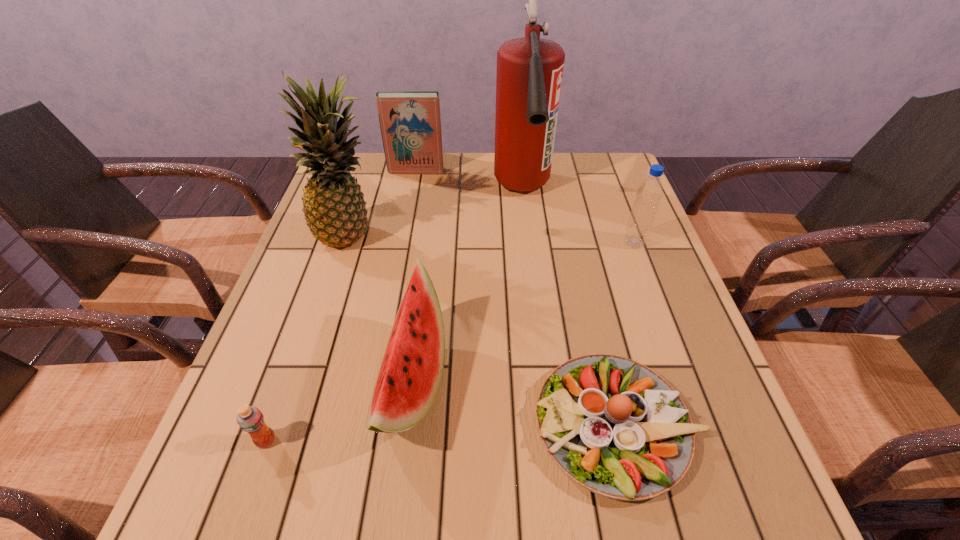
Find the location of a particular element. The width and height of the screenshot is (960, 540). salad plate present at the right edge is located at coordinates (614, 426).

Find the location of `object located at the near right corner`. object located at the near right corner is located at coordinates (614, 426).

I want to click on free space at the far edge of the desktop, so click(569, 171).

Locate an element on the screen. Image resolution: width=960 pixels, height=540 pixels. vacant space at the near edge of the desktop is located at coordinates (410, 510).

In order to click on vacant space at the left edge of the desktop in this screenshot , I will do `click(269, 389)`.

This screenshot has width=960, height=540. I want to click on vacant space at the right edge, so click(x=642, y=254).

Find the location of `free space at the far right corner of the desktop`. free space at the far right corner of the desktop is located at coordinates (600, 156).

The width and height of the screenshot is (960, 540). In order to click on free area in between the shortest object and the third shortest object in this screenshot , I will do `click(514, 403)`.

Locate an element on the screen. The height and width of the screenshot is (540, 960). free space between the shortest object and the fire extinguisher is located at coordinates (569, 308).

The height and width of the screenshot is (540, 960). Identify the location of empty location between the orange juice and the water bottle. (450, 342).